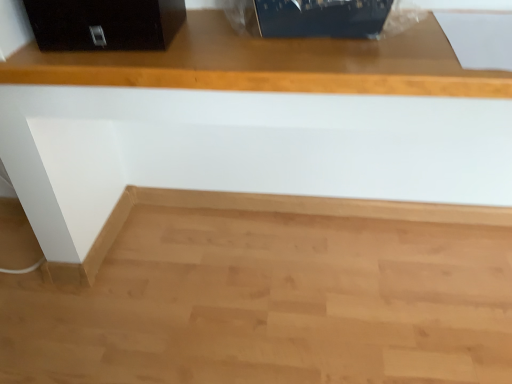
Question: Can you confirm if black glossy file cabinet at upper left is positioned to the left of natural wood cabinet at upper center?

Choices:
 (A) no
 (B) yes

Answer: (B)

Question: Does black glossy file cabinet at upper left have a lesser width compared to natural wood cabinet at upper center?

Choices:
 (A) no
 (B) yes

Answer: (B)

Question: Considering the relative sizes of black glossy file cabinet at upper left and natural wood cabinet at upper center in the image provided, is black glossy file cabinet at upper left shorter than natural wood cabinet at upper center?

Choices:
 (A) no
 (B) yes

Answer: (B)

Question: Is black glossy file cabinet at upper left beside natural wood cabinet at upper center?

Choices:
 (A) no
 (B) yes

Answer: (A)

Question: Can you confirm if black glossy file cabinet at upper left is smaller than natural wood cabinet at upper center?

Choices:
 (A) yes
 (B) no

Answer: (A)

Question: Can natural wood cabinet at upper center be found inside black glossy file cabinet at upper left?

Choices:
 (A) no
 (B) yes

Answer: (A)

Question: From the image's perspective, is natural wood cabinet at upper center over black glossy file cabinet at upper left?

Choices:
 (A) yes
 (B) no

Answer: (B)

Question: Is natural wood cabinet at upper center beside black glossy file cabinet at upper left?

Choices:
 (A) no
 (B) yes

Answer: (A)

Question: Is natural wood cabinet at upper center looking in the opposite direction of black glossy file cabinet at upper left?

Choices:
 (A) no
 (B) yes

Answer: (A)

Question: Is natural wood cabinet at upper center at the left side of black glossy file cabinet at upper left?

Choices:
 (A) yes
 (B) no

Answer: (B)

Question: Is natural wood cabinet at upper center smaller than black glossy file cabinet at upper left?

Choices:
 (A) yes
 (B) no

Answer: (B)

Question: From a real-world perspective, is natural wood cabinet at upper center physically below black glossy file cabinet at upper left?

Choices:
 (A) yes
 (B) no

Answer: (A)

Question: Considering the positions of point (305, 48) and point (36, 41), is point (305, 48) closer or farther from the camera than point (36, 41)?

Choices:
 (A) closer
 (B) farther

Answer: (A)